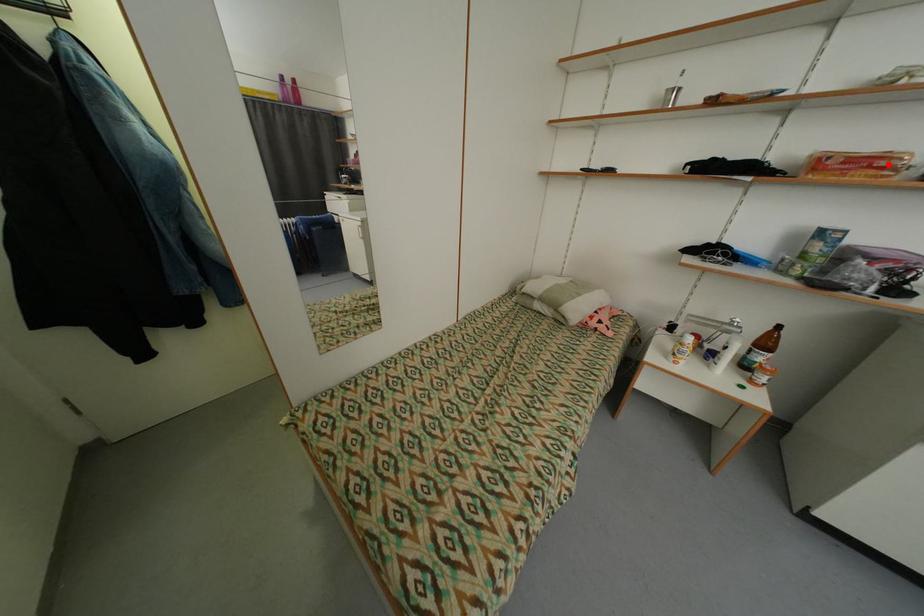
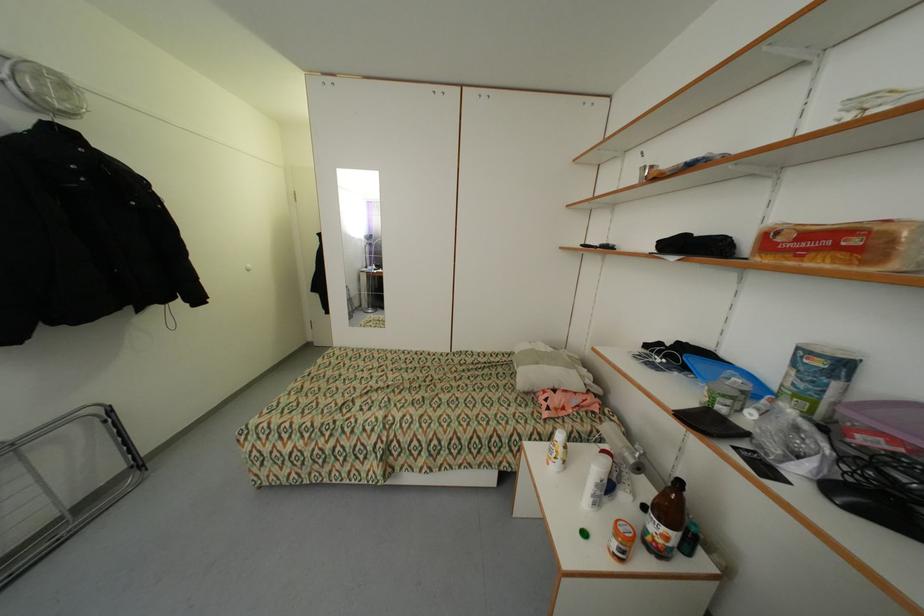
Find the pixel in the second image that matches the highlighted location in the first image.

(860, 241)